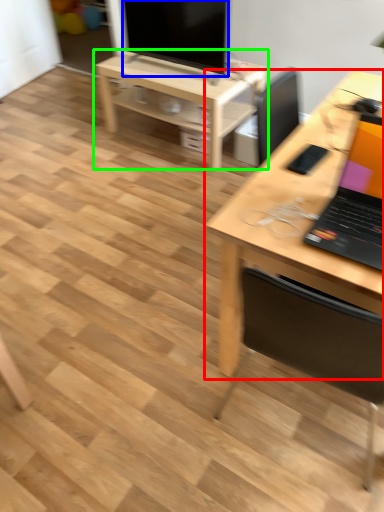
Question: Based on their relative distances, which object is farther from desk (highlighted by a red box)? Choose from television (highlighted by a blue box) and table (highlighted by a green box).

Choices:
 (A) television
 (B) table

Answer: (A)